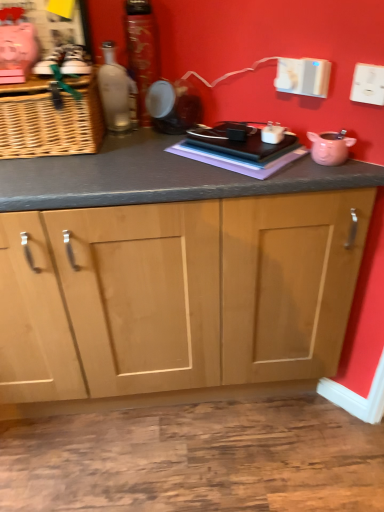
The width and height of the screenshot is (384, 512). What do you see at coordinates (173, 106) in the screenshot?
I see `matte black speaker at center, which is counted as the second appliance, starting from the right` at bounding box center [173, 106].

Image resolution: width=384 pixels, height=512 pixels. I want to click on woven brown basket at left, so click(x=50, y=119).

Find the location of `matte black speaker at center, the 1th appliance viewed from the back`. matte black speaker at center, the 1th appliance viewed from the back is located at coordinates (173, 106).

In the scene shown: Which of these two, pink matte piggy bank at right, the 1th appliance in the front-to-back sequence, or matte glass bottle at upper left, the 2th bottle viewed from the right, stands shorter?

Standing shorter between the two is pink matte piggy bank at right, the 1th appliance in the front-to-back sequence.

In the image, is pink matte piggy bank at right, the first appliance positioned from the right, on the left side or the right side of matte glass bottle at upper left, the 1th bottle from the left?

In the image, pink matte piggy bank at right, the first appliance positioned from the right, appears on the right side of matte glass bottle at upper left, the 1th bottle from the left.

Is there a large distance between pink matte piggy bank at right, the 1th appliance in the front-to-back sequence, and matte glass bottle at upper left, the 1th bottle from the left?

No.

Can you tell me how much pink matte piggy bank at right, the second appliance in the left-to-right sequence, and matte glass bottle at upper left, the 2th bottle viewed from the right, differ in facing direction?

The angle between the facing direction of pink matte piggy bank at right, the second appliance in the left-to-right sequence, and the facing direction of matte glass bottle at upper left, the 2th bottle viewed from the right, is 49.6 degrees.

Is pink matte piggy bank at right, the second appliance in the left-to-right sequence, wider or thinner than woven brown basket at left?

Considering their sizes, pink matte piggy bank at right, the second appliance in the left-to-right sequence, looks slimmer than woven brown basket at left.

From a real-world perspective, which object rests below the other?

pink matte piggy bank at right, the 1th appliance in the front-to-back sequence.

Consider the image. Does pink matte piggy bank at right, the 1th appliance in the front-to-back sequence, appear on the right side of woven brown basket at left?

Yes, pink matte piggy bank at right, the 1th appliance in the front-to-back sequence, is to the right of woven brown basket at left.

Is pink matte piggy bank at right, which appears as the 2th appliance when viewed from the back, facing away from woven brown basket at left?

pink matte piggy bank at right, which appears as the 2th appliance when viewed from the back, is not turned away from woven brown basket at left.

Is woven brown basket at left wider than shiny metallic can at center, the 1th bottle when ordered from right to left?

Yes.

From a real-world perspective, between woven brown basket at left and shiny metallic can at center, the 1th bottle when ordered from right to left, who is vertically higher?

shiny metallic can at center, the 1th bottle when ordered from right to left, from a real-world perspective.

Considering the points (93, 141) and (157, 62), which point is in front, point (93, 141) or point (157, 62)?

The point (93, 141) is closer to the camera.

Is the position of woven brown basket at left less distant than that of shiny metallic can at center, which appears as the 2th bottle when viewed from the left?

Yes, the depth of woven brown basket at left is less than that of shiny metallic can at center, which appears as the 2th bottle when viewed from the left.

Are shiny metallic can at center, the 1th bottle when ordered from right to left, and matte black speaker at center, the 1th appliance viewed from the back, making contact?

shiny metallic can at center, the 1th bottle when ordered from right to left, is not next to matte black speaker at center, the 1th appliance viewed from the back, and they're not touching.

From the image's perspective, would you say shiny metallic can at center, the 1th bottle when ordered from right to left, is positioned over matte black speaker at center, the first appliance positioned from the top?

Correct, shiny metallic can at center, the 1th bottle when ordered from right to left, appears higher than matte black speaker at center, the first appliance positioned from the top, in the image.

Which object is thinner, shiny metallic can at center, the 1th bottle when ordered from right to left, or matte black speaker at center, the 1th appliance viewed from the back?

Thinner between the two is matte black speaker at center, the 1th appliance viewed from the back.

The image size is (384, 512). Find the location of `the 1st appliance to the right of the shiny metallic can at center, which appears as the 2th bottle when viewed from the left, starting your count from the anchor`. the 1st appliance to the right of the shiny metallic can at center, which appears as the 2th bottle when viewed from the left, starting your count from the anchor is located at coordinates (173, 106).

From the image's perspective, which is above, matte glass bottle at upper left, the 1th bottle from the left, or matte black speaker at center, which is counted as the second appliance, starting from the right?

matte glass bottle at upper left, the 1th bottle from the left, from the image's perspective.

Does matte glass bottle at upper left, the 2th bottle viewed from the right, lie behind matte black speaker at center, the 1th appliance viewed from the back?

No, it is in front of matte black speaker at center, the 1th appliance viewed from the back.

Between point (109, 50) and point (178, 113), which one is positioned in front?

The point (178, 113) is in front.

From a real-world perspective, is matte glass bottle at upper left, the 2th bottle viewed from the right, positioned over matte black speaker at center, the first appliance positioned from the top, based on gravity?

Yes, from a real-world perspective, matte glass bottle at upper left, the 2th bottle viewed from the right, is over matte black speaker at center, the first appliance positioned from the top

Which is behind, woven brown basket at left or matte glass bottle at upper left, the 2th bottle viewed from the right?

matte glass bottle at upper left, the 2th bottle viewed from the right, is behind.

Is woven brown basket at left bigger or smaller than matte glass bottle at upper left, the 2th bottle viewed from the right?

Clearly, woven brown basket at left is larger in size than matte glass bottle at upper left, the 2th bottle viewed from the right.

From a real-world perspective, which object stands above the other?

matte glass bottle at upper left, the 1th bottle from the left, is physically above.

In the scene shown: From the image's perspective, does woven brown basket at left appear lower than matte glass bottle at upper left, the 2th bottle viewed from the right?

Yes, from the image's perspective, woven brown basket at left is beneath matte glass bottle at upper left, the 2th bottle viewed from the right.

Considering the relative positions of matte black speaker at center, the 1th appliance viewed from the back, and pink matte piggy bank at right, the first appliance positioned from the right, in the image provided, is matte black speaker at center, the 1th appliance viewed from the back, in front of pink matte piggy bank at right, the first appliance positioned from the right,?

No, matte black speaker at center, the 1th appliance viewed from the back, is further to the viewer.

Is matte black speaker at center, which is counted as the second appliance, starting from the right, smaller than pink matte piggy bank at right, which is the first appliance from bottom to top?

Actually, matte black speaker at center, which is counted as the second appliance, starting from the right, might be larger than pink matte piggy bank at right, which is the first appliance from bottom to top.

From the image's perspective, is matte black speaker at center, the 1th appliance viewed from the back, located above or below pink matte piggy bank at right, the first appliance positioned from the right?

matte black speaker at center, the 1th appliance viewed from the back, is above pink matte piggy bank at right, the first appliance positioned from the right.

In the scene shown: Is matte black speaker at center, the 1th appliance when ordered from left to right, looking in the opposite direction of pink matte piggy bank at right, which is the first appliance from bottom to top?

matte black speaker at center, the 1th appliance when ordered from left to right, does not have its back to pink matte piggy bank at right, which is the first appliance from bottom to top.

From the image's perspective, starting from the matte glass bottle at upper left, the 2th bottle viewed from the right, which appliance is the 2nd one below? Please provide its 2D coordinates.

[(330, 147)]

The image size is (384, 512). In order to click on basket behind the pink matte piggy bank at right, the second appliance in the left-to-right sequence in this screenshot , I will do coord(50,119).

Looking at the image, which one is located further to pink matte piggy bank at right, the first appliance positioned from the right, woven brown basket at left or shiny metallic can at center, the 1th bottle when ordered from right to left?

woven brown basket at left lies further to pink matte piggy bank at right, the first appliance positioned from the right, than the other object.

Based on their spatial positions, is shiny metallic can at center, the 1th bottle when ordered from right to left, or matte black speaker at center, which ranks as the 2th appliance in front-to-back order, closer to woven brown basket at left?

The object closer to woven brown basket at left is matte black speaker at center, which ranks as the 2th appliance in front-to-back order.

Which object lies further to the anchor point matte black speaker at center, which is counted as the second appliance, starting from the right, pink matte piggy bank at right, the second appliance positioned from the top, or woven brown basket at left?

pink matte piggy bank at right, the second appliance positioned from the top, is positioned further to the anchor matte black speaker at center, which is counted as the second appliance, starting from the right.

Based on their spatial positions, is shiny metallic can at center, the 1th bottle when ordered from right to left, or matte black speaker at center, the 1th appliance viewed from the back, closer to pink matte piggy bank at right, which appears as the 2th appliance when viewed from the back?

The object closer to pink matte piggy bank at right, which appears as the 2th appliance when viewed from the back, is matte black speaker at center, the 1th appliance viewed from the back.

Looking at the image, which one is located further to woven brown basket at left, shiny metallic can at center, the 1th bottle when ordered from right to left, or pink matte piggy bank at right, the second appliance in the left-to-right sequence?

pink matte piggy bank at right, the second appliance in the left-to-right sequence, is further to woven brown basket at left.

When comparing their distances from matte glass bottle at upper left, the 2th bottle viewed from the right, does woven brown basket at left or pink matte piggy bank at right, the second appliance in the left-to-right sequence, seem further?

The object further to matte glass bottle at upper left, the 2th bottle viewed from the right, is pink matte piggy bank at right, the second appliance in the left-to-right sequence.

Looking at the image, which one is located further to shiny metallic can at center, which appears as the 2th bottle when viewed from the left, pink matte piggy bank at right, the 1th appliance in the front-to-back sequence, or matte glass bottle at upper left, the 1th bottle from the left?

pink matte piggy bank at right, the 1th appliance in the front-to-back sequence, is further to shiny metallic can at center, which appears as the 2th bottle when viewed from the left.

Considering their positions, is matte glass bottle at upper left, the 2th bottle viewed from the right, positioned closer to woven brown basket at left than matte black speaker at center, placed as the second appliance when sorted from bottom to top?

matte glass bottle at upper left, the 2th bottle viewed from the right.

This screenshot has height=512, width=384. Identify the location of bottle situated between matte glass bottle at upper left, the 1th bottle from the left, and matte black speaker at center, the 1th appliance when ordered from left to right, from left to right. (142, 51).

Identify the location of appliance between matte glass bottle at upper left, the 2th bottle viewed from the right, and pink matte piggy bank at right, which is the first appliance from bottom to top. This screenshot has height=512, width=384. (173, 106).

What are the coordinates of `appliance located between woven brown basket at left and pink matte piggy bank at right, the second appliance in the left-to-right sequence, in the left-right direction` in the screenshot? It's located at (173, 106).

I want to click on appliance between shiny metallic can at center, the 1th bottle when ordered from right to left, and pink matte piggy bank at right, the first appliance positioned from the right, from left to right, so click(x=173, y=106).